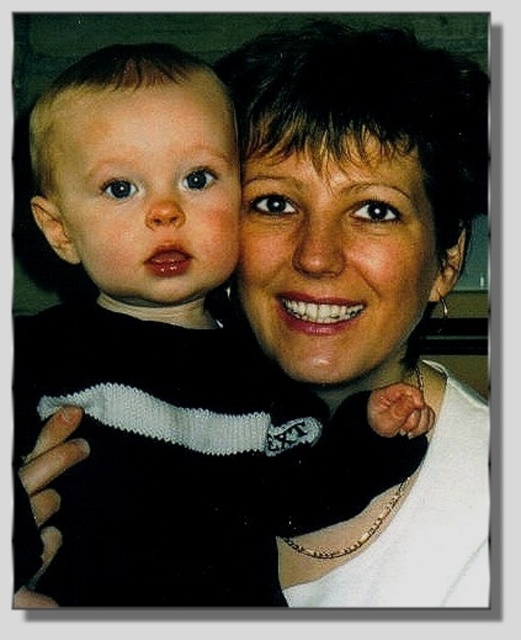
Question: Is matte black sweater at center smaller than smooth skin face at center?

Choices:
 (A) no
 (B) yes

Answer: (A)

Question: Can you confirm if smooth skin face at center is positioned to the right of matte black baby at left?

Choices:
 (A) no
 (B) yes

Answer: (B)

Question: Which point is farther from the camera taking this photo?

Choices:
 (A) (314, 189)
 (B) (68, 516)

Answer: (A)

Question: Does smooth skin face at center appear on the left side of matte black baby at left?

Choices:
 (A) no
 (B) yes

Answer: (A)

Question: Based on their relative distances, which object is nearer to the smooth skin face at center?

Choices:
 (A) black knitted sweater at left
 (B) matte black sweater at center

Answer: (B)

Question: Which of the following is the closest to the observer?

Choices:
 (A) black knitted sweater at left
 (B) matte black sweater at center
 (C) matte black baby at left
 (D) smooth skin face at center

Answer: (A)